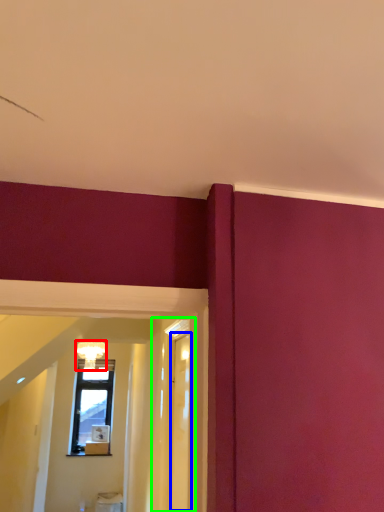
Question: Which object is the farthest from light fixture (highlighted by a red box)? Choose among these: glass door (highlighted by a blue box) or glass door (highlighted by a green box).

Choices:
 (A) glass door
 (B) glass door

Answer: (A)